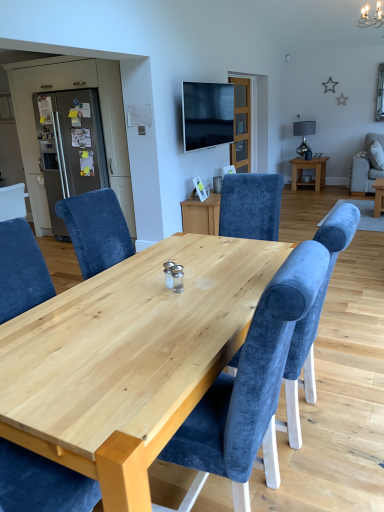
Question: Does point (357, 156) appear closer or farther from the camera than point (11, 110)?

Choices:
 (A) farther
 (B) closer

Answer: (A)

Question: Considering the positions of velvet blue chair at right, which appears as the 1th chair when viewed from the top, and matte gray refrigerator at left in the image, is velvet blue chair at right, which appears as the 1th chair when viewed from the top, taller or shorter than matte gray refrigerator at left?

Choices:
 (A) tall
 (B) short

Answer: (A)

Question: Estimate the real-world distances between objects in this image. Which object is closer to the clear glass door at center?

Choices:
 (A) matte glass lamp at upper center
 (B) metallic gray refrigerator at left
 (C) satin silver refrigerator at left
 (D) flat screen tv at upper center
 (E) natural wood table at center

Answer: (D)

Question: Which object is the closest to the natural wood table at center?

Choices:
 (A) flat screen tv at upper center
 (B) satin silver refrigerator at left
 (C) velvet blue chair at right, the second chair positioned from the front
 (D) matte glass lamp at upper center
 (E) velvet blue chair at center, the second chair in the right-to-left sequence

Answer: (E)